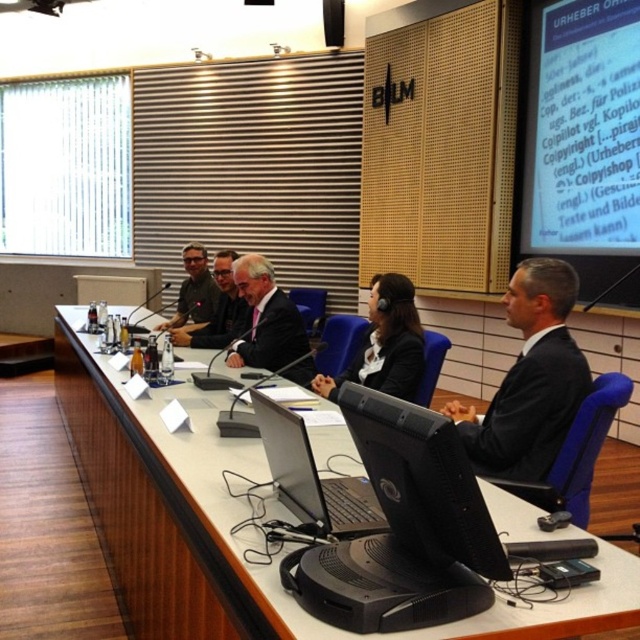
Question: Is black plastic laptop at center above silver metallic laptop at center?

Choices:
 (A) no
 (B) yes

Answer: (B)

Question: Which object is farther from the camera taking this photo?

Choices:
 (A) matte black suit at center
 (B) matte black suit at left
 (C) black glossy suit at center
 (D) black plastic laptop at center

Answer: (B)

Question: Which of these objects is positioned farthest from the dark gray suit at center?

Choices:
 (A) dark suit at center
 (B) silver metallic laptop at center

Answer: (B)

Question: Is black plastic laptop at center closer to camera compared to matte black suit at center?

Choices:
 (A) yes
 (B) no

Answer: (A)

Question: Which point is closer to the camera?

Choices:
 (A) matte black suit at center
 (B) matte black suit at left
 (C) black plastic laptop at center

Answer: (C)

Question: Is dark suit at center to the left of matte black suit at left from the viewer's perspective?

Choices:
 (A) no
 (B) yes

Answer: (A)